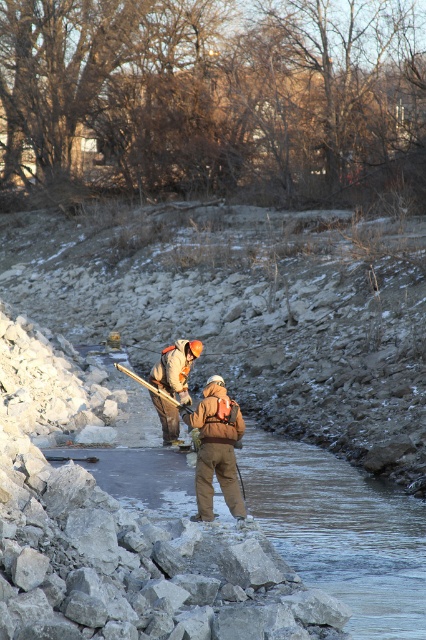
Between point (270, 481) and point (173, 372), which one is positioned in front?

Point (270, 481) is in front.

Describe the element at coordinates (340, 531) in the screenshot. The image size is (426, 640). I see `clear ice at center` at that location.

Between point (417, 532) and point (169, 346), which one is positioned in front?

Point (417, 532) is in front.

This screenshot has width=426, height=640. I want to click on clear ice at center, so click(x=340, y=531).

I want to click on brown fuzzy jacket at center, so 216,449.

Image resolution: width=426 pixels, height=640 pixels. What do you see at coordinates (216, 449) in the screenshot? I see `brown fuzzy jacket at center` at bounding box center [216, 449].

This screenshot has width=426, height=640. What are the coordinates of `brown fuzzy jacket at center` in the screenshot? It's located at (216, 449).

Does clear ice at center have a smaller size compared to brown fuzzy jacket at center?

Yes.

Who is more forward, [112,484] or [199,481]?

Point [199,481] is in front.

Who is more forward, (253, 449) or (227, 433)?

Positioned in front is point (227, 433).

The width and height of the screenshot is (426, 640). What are the coordinates of `clear ice at center` in the screenshot? It's located at (340, 531).